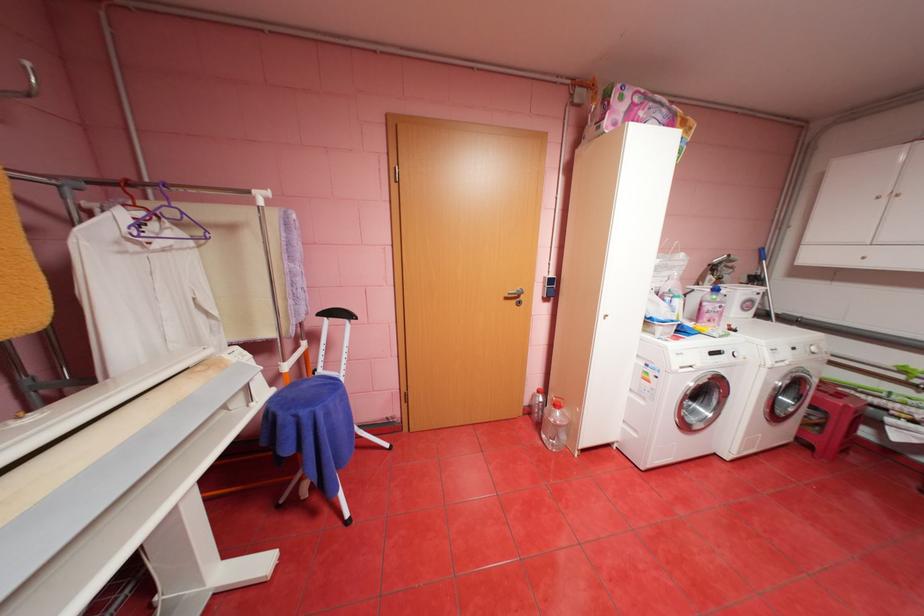
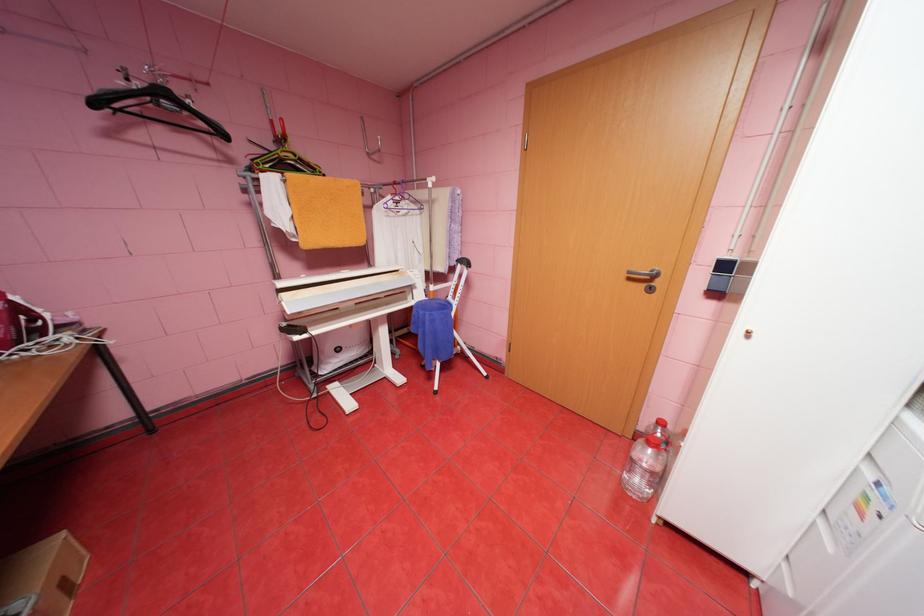
In the second image, find the point that corresponds to (x=566, y=411) in the first image.

(659, 451)